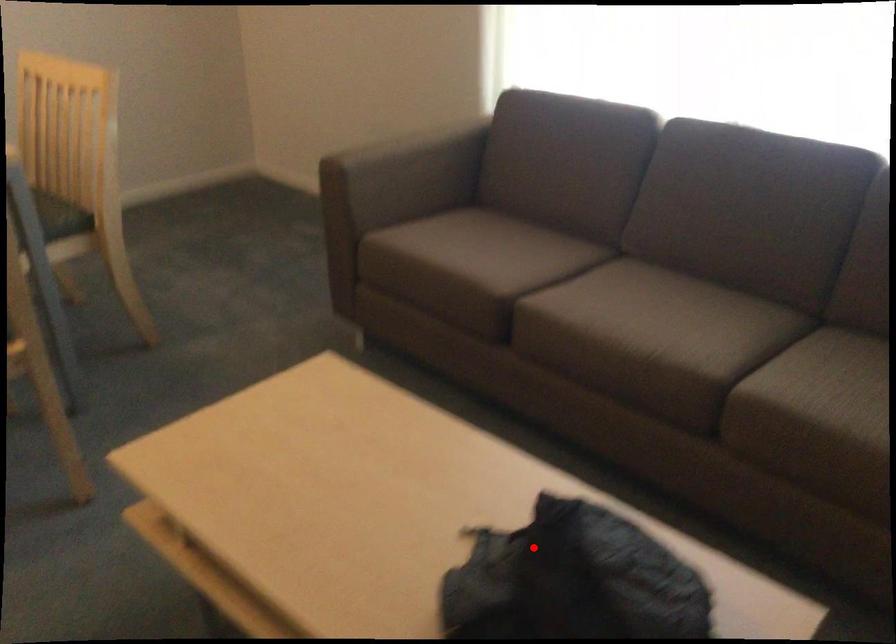
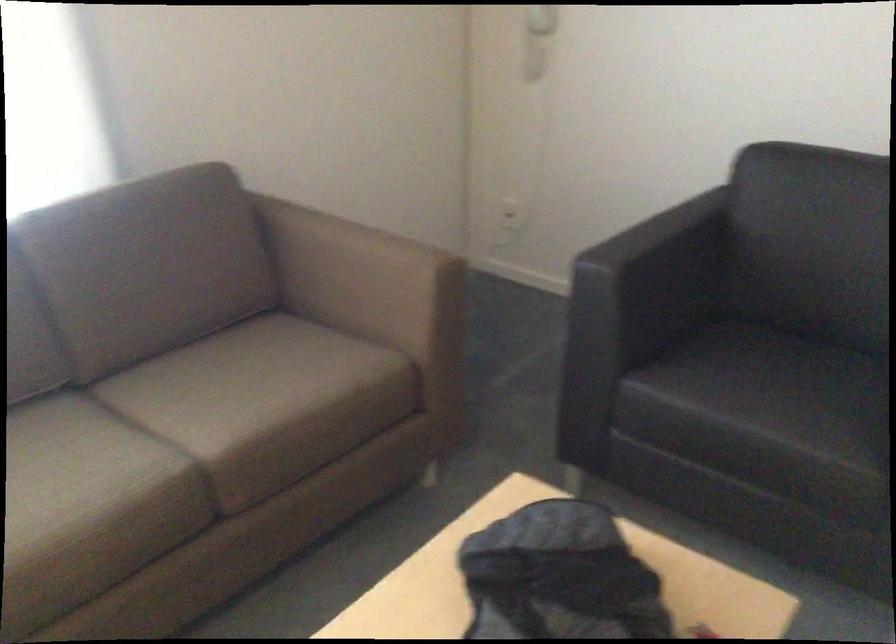
Where in the second image is the point corresponding to the highlighted location from the first image?

(558, 576)